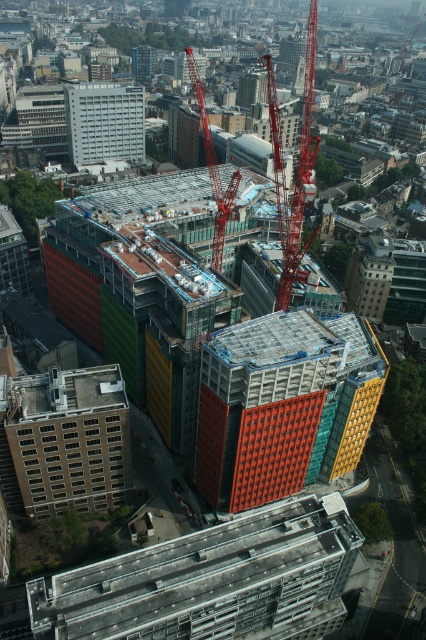
In the scene shown: You are a construction worker looking at the aerial view of the construction site. You need to determine the order of the two structures from your viewpoint. Which structure is closer to you, the concrete roof at center or the white concrete building at center?

The concrete roof at center is closer to the viewer than the white concrete building at center.

You are a construction worker planning to install a new antenna on the tallest structure in the scene. Based on the image, which structure should you choose between the white concrete building at center and the metallic red crane at center?

The metallic red crane at center is taller than the white concrete building at center, so you should install the antenna on the metallic red crane at center.

You are a construction worker planning to move a heavy load from the metallic red crane at center to the white concrete building at center. Which object will the load pass in front of first?

The load will first pass in front of the white concrete building at center because the metallic red crane at center is positioned behind it, so the crane is farther away from the worker.